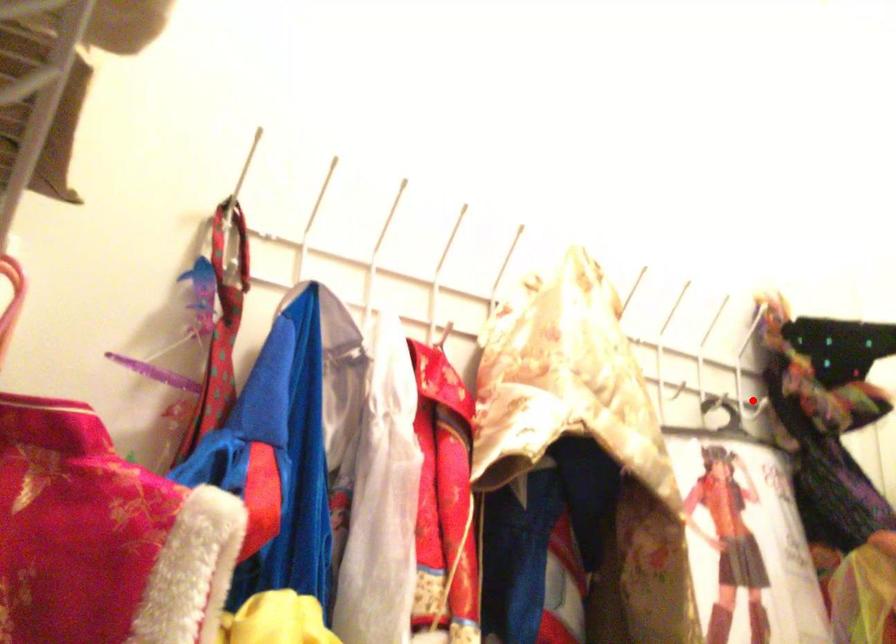
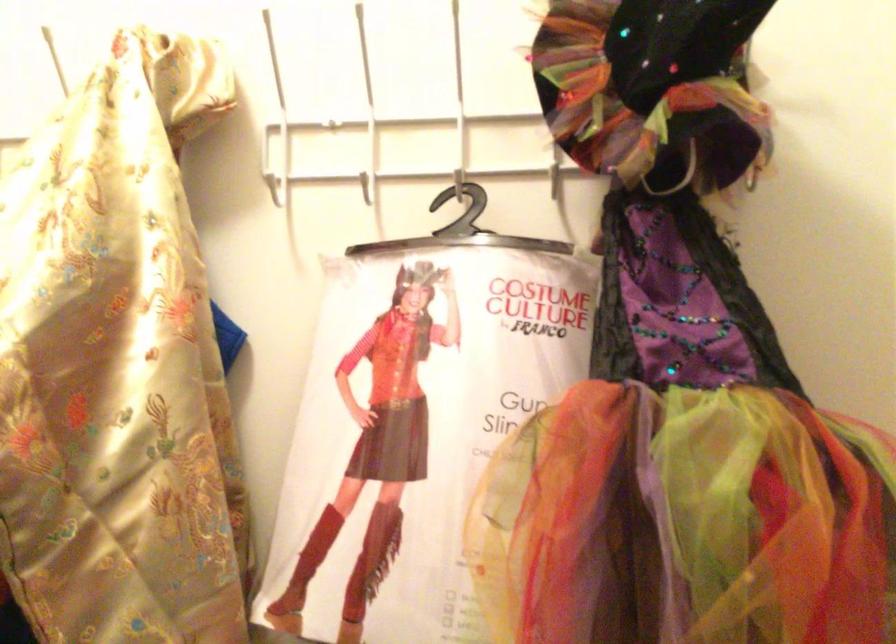
Locate, in the second image, the point that corresponds to the highlighted location in the first image.

(554, 180)